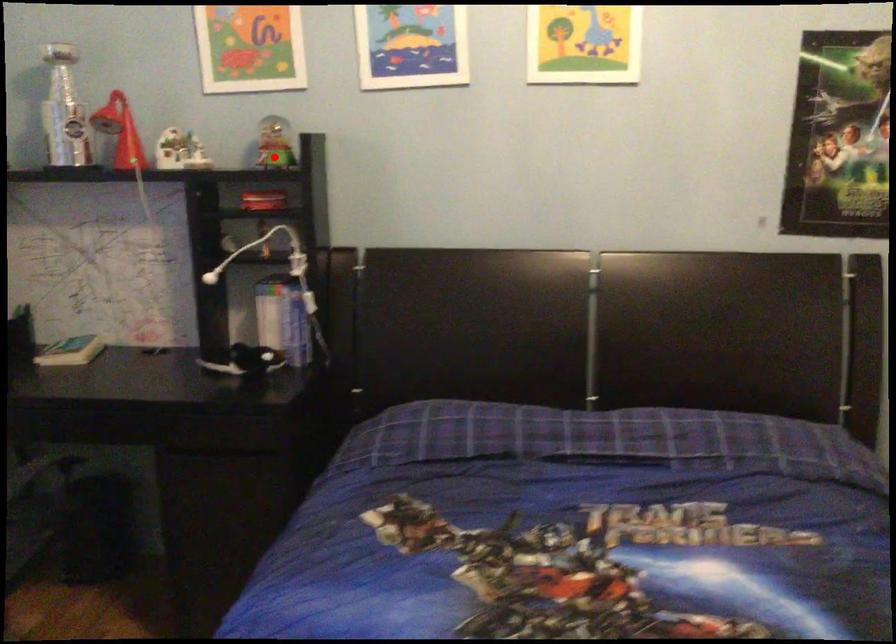
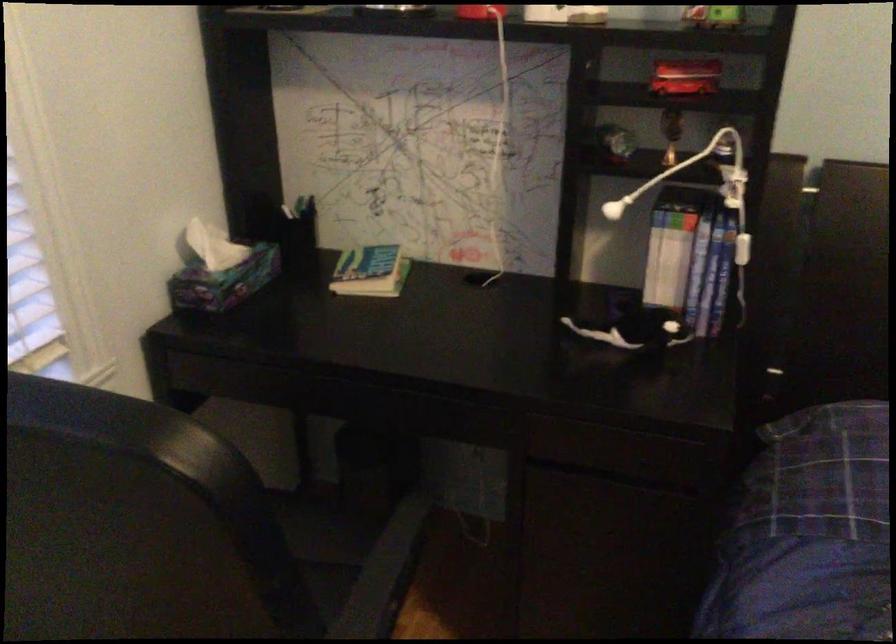
Locate, in the second image, the point that corresponds to the highlighted location in the first image.

(713, 17)